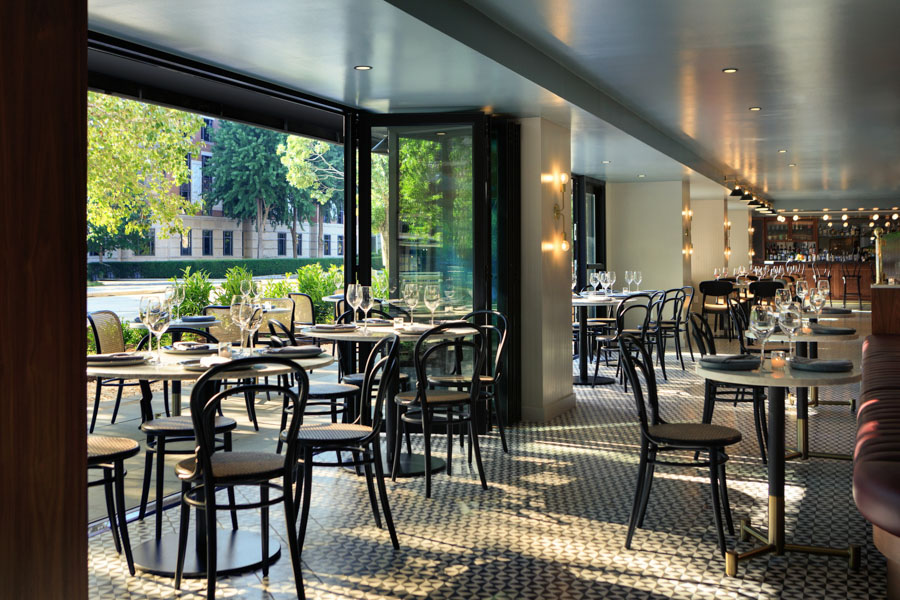
You are a GUI agent. You are given a task and a screenshot of the screen. Output one action in this format:
    pyautogui.click(x=<x>, y=<y>)
    Task: Click on the candle
    The width and height of the screenshot is (900, 600).
    Given the screenshot: What is the action you would take?
    pyautogui.click(x=778, y=359)